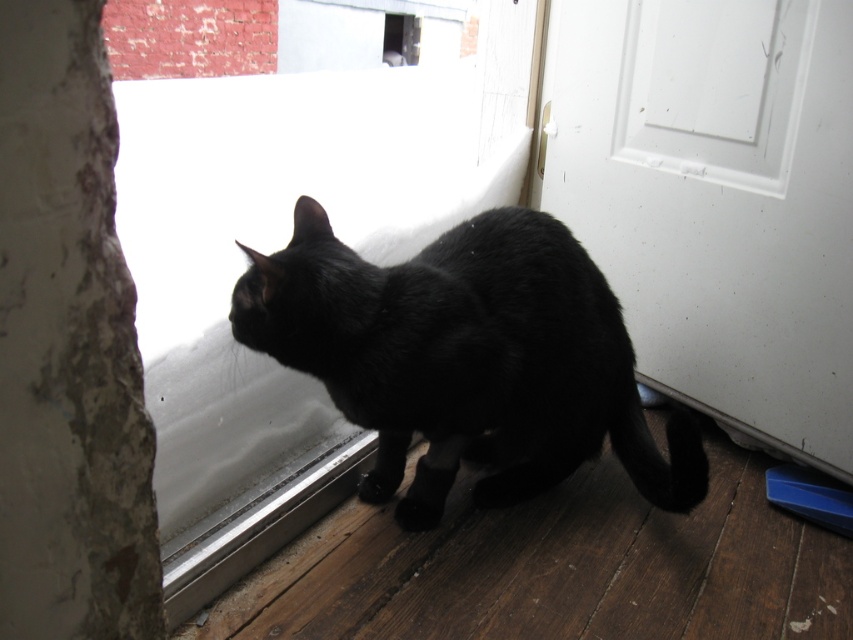
Question: Can you confirm if white glossy screen door at lower right is positioned to the right of black matte fur cat at center?

Choices:
 (A) no
 (B) yes

Answer: (B)

Question: Can you confirm if white glossy screen door at lower right is thinner than black matte fur cat at center?

Choices:
 (A) yes
 (B) no

Answer: (A)

Question: Is white glossy screen door at lower right positioned at the back of black matte fur cat at center?

Choices:
 (A) yes
 (B) no

Answer: (A)

Question: Which is nearer to the white glossy screen door at lower right?

Choices:
 (A) transparent glass window at center
 (B) black matte fur cat at center

Answer: (B)

Question: Which point is closer to the camera taking this photo?

Choices:
 (A) (509, 134)
 (B) (376, 292)
 (C) (840, 275)

Answer: (B)

Question: Estimate the real-world distances between objects in this image. Which object is farther from the transparent glass window at center?

Choices:
 (A) black matte fur cat at center
 (B) white glossy screen door at lower right

Answer: (B)